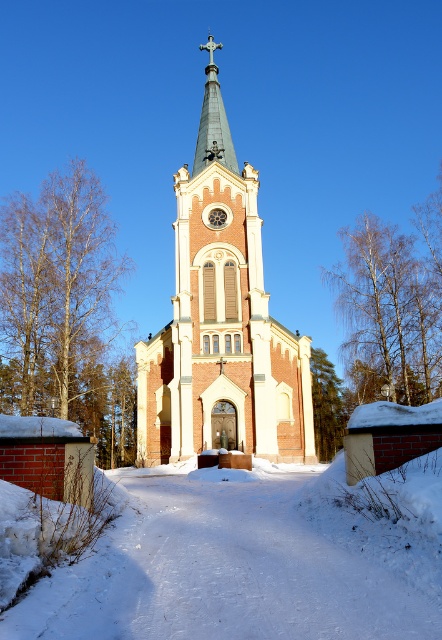
Question: Among these objects, which one is nearest to the camera?

Choices:
 (A) shiny gold spire at center
 (B) light beige stone church steeple at center

Answer: (B)

Question: Is white powdery snow at center closer to the viewer compared to light beige stone church steeple at center?

Choices:
 (A) no
 (B) yes

Answer: (B)

Question: Can you confirm if white powdery snow at center is smaller than shiny gold spire at center?

Choices:
 (A) no
 (B) yes

Answer: (B)

Question: Which object is closer to the camera taking this photo?

Choices:
 (A) shiny gold spire at center
 (B) light beige stone church steeple at center

Answer: (B)

Question: Which object is farther from the camera taking this photo?

Choices:
 (A) light beige stone church steeple at center
 (B) white powdery snow at center

Answer: (A)

Question: Observing the image, what is the correct spatial positioning of light beige stone church steeple at center in reference to shiny gold spire at center?

Choices:
 (A) right
 (B) left

Answer: (A)